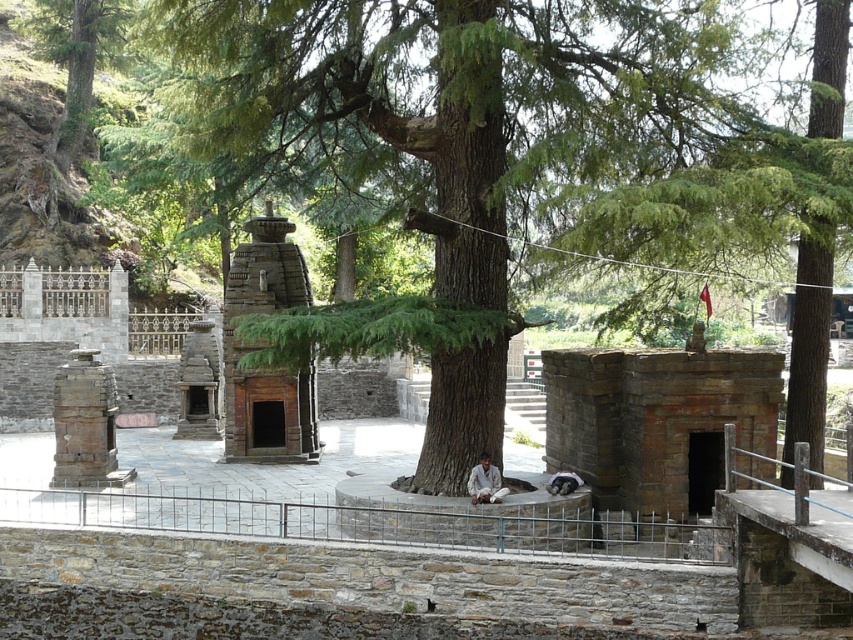
Question: Which point is farther to the camera?

Choices:
 (A) (489, 499)
 (B) (242, 531)

Answer: (B)

Question: Is metal/rustic rail at center closer to camera compared to white cotton dhoti at center?

Choices:
 (A) yes
 (B) no

Answer: (A)

Question: Which point is farther to the camera?

Choices:
 (A) (476, 486)
 (B) (593, 83)

Answer: (B)

Question: Does green rough bark tree at center come in front of metal/rustic rail at center?

Choices:
 (A) yes
 (B) no

Answer: (A)

Question: Can you confirm if green rough bark tree at center is positioned to the left of white cotton dhoti at center?

Choices:
 (A) no
 (B) yes

Answer: (B)

Question: Which of the following is the farthest from the observer?

Choices:
 (A) white cotton dhoti at center
 (B) green rough bark tree at center

Answer: (A)